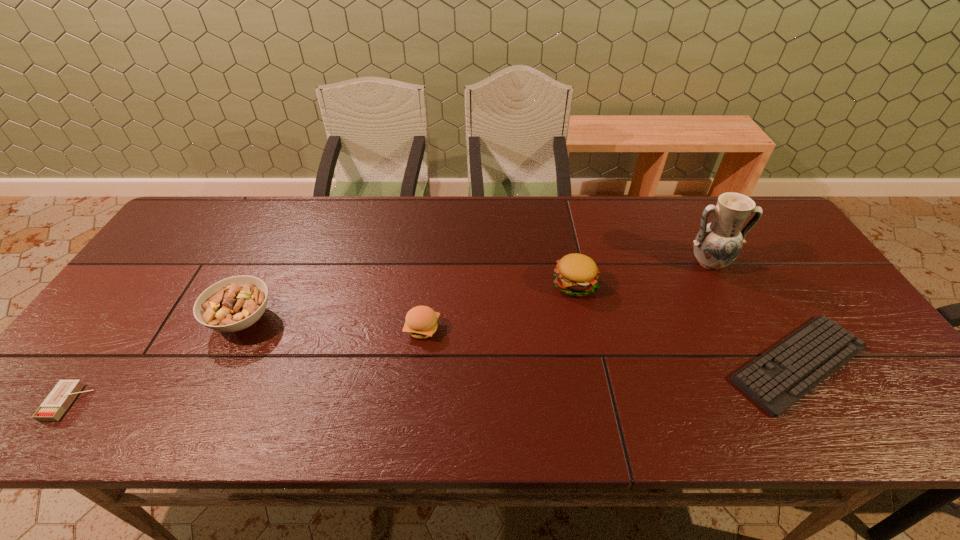
Find the location of `the tallest object`. the tallest object is located at coordinates (717, 244).

Find the location of a particular element. the taller hamburger is located at coordinates (575, 275).

The width and height of the screenshot is (960, 540). Find the location of `the right hamburger`. the right hamburger is located at coordinates (575, 275).

At what (x,y) coordinates should I click in order to perform the action: click on stew. Please return your answer as a coordinate pair (x, y). This screenshot has height=540, width=960. Looking at the image, I should click on (235, 303).

Where is `the fourth object from right to left`? the fourth object from right to left is located at coordinates (421, 321).

You are a GUI agent. You are given a task and a screenshot of the screen. Output one action in this format:
    pyautogui.click(x=<x>, y=<y>)
    Task: Click on the left hamburger
    
    Given the screenshot: What is the action you would take?
    pyautogui.click(x=421, y=321)

Where is `the leftmost object`? the leftmost object is located at coordinates (59, 399).

This screenshot has width=960, height=540. I want to click on the fifth tallest object, so click(x=59, y=399).

Where is `the shortest object`? the shortest object is located at coordinates (777, 379).

At what (x,y) coordinates should I click in order to perform the action: click on free location located on either side of the pottery. Please return your answer as a coordinate pair (x, y). The image size is (960, 540). Looking at the image, I should click on (768, 375).